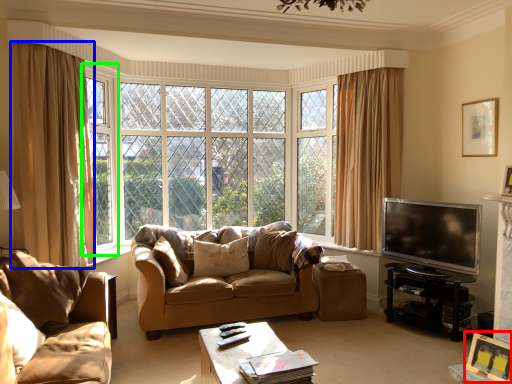
Question: Which is farther away from picture frame (highlighted by a red box)? curtain (highlighted by a blue box) or window frame (highlighted by a green box)?

Choices:
 (A) curtain
 (B) window frame

Answer: (B)